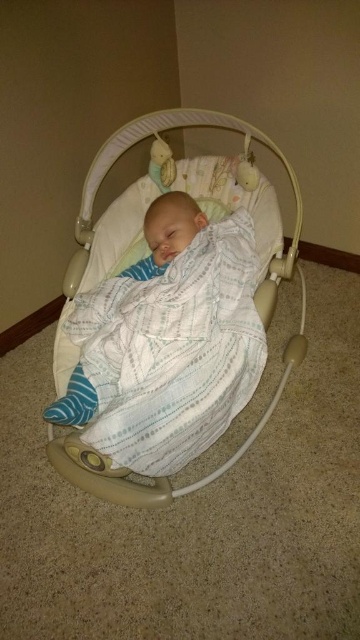
You are a parent standing in front of the beige fabric baby swing at center. You want to place a 4 feet long toy on the swing. Can you fit the toy on the swing?

The beige fabric baby swing at center is 3.90 feet from viewer. Since the toy is 4 feet long, it may not fit entirely on the swing as the swing is slightly shorter than the toy.

You are a parent trying to place a new toy on the beige fabric baby swing at center. The toy is the same width as the white textured blanket at center. Will the toy fit on the swing?

The beige fabric baby swing at center might be wider than the white textured blanket at center, so the toy, which is the same width as the blanket, should fit on the swing since the swing is possibly wider.

You are a parent trying to place the soft plush toy at upper center on the beige fabric baby swing at center. Based on their sizes, will the toy fit comfortably without falling off?

The beige fabric baby swing at center has a larger size compared to the soft plush toy at upper center, so the toy will fit comfortably and securely on the swing without falling off.